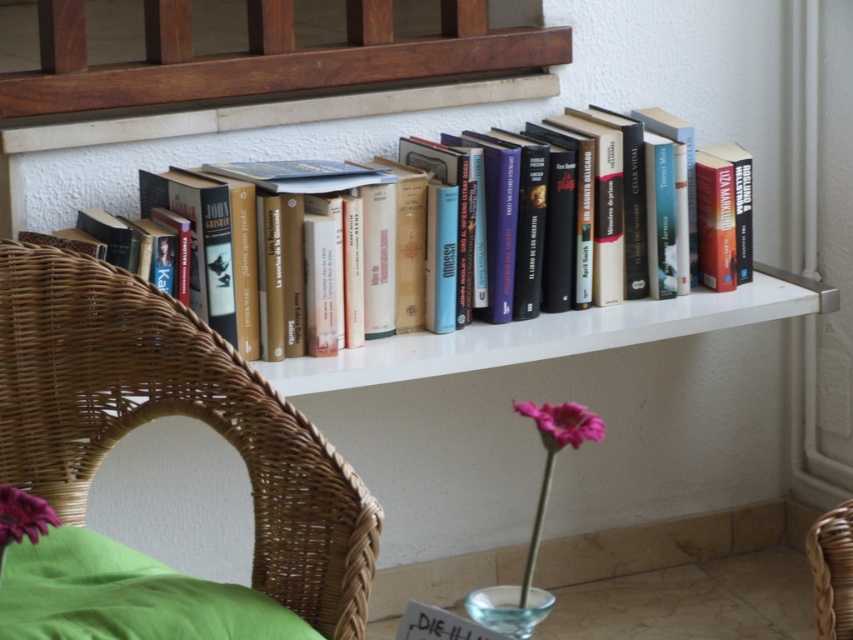
Question: Can you confirm if green fabric pillow at lower left is positioned to the left of transparent glass vase at lower center?

Choices:
 (A) yes
 (B) no

Answer: (A)

Question: Among these points, which one is farthest from the camera?

Choices:
 (A) (604, 189)
 (B) (318, 488)
 (C) (535, 422)
 (D) (9, 492)

Answer: (A)

Question: Which point appears farthest from the camera in this image?

Choices:
 (A) (512, 628)
 (B) (166, 605)

Answer: (B)

Question: Among these objects, which one is nearest to the camera?

Choices:
 (A) woven wicker chair at left
 (B) pink matte flower at lower left

Answer: (B)

Question: Is white glossy shelf at center above woven brown basket at lower right?

Choices:
 (A) yes
 (B) no

Answer: (A)

Question: Does wooden at upper center have a lesser width compared to transparent glass vase at lower center?

Choices:
 (A) yes
 (B) no

Answer: (B)